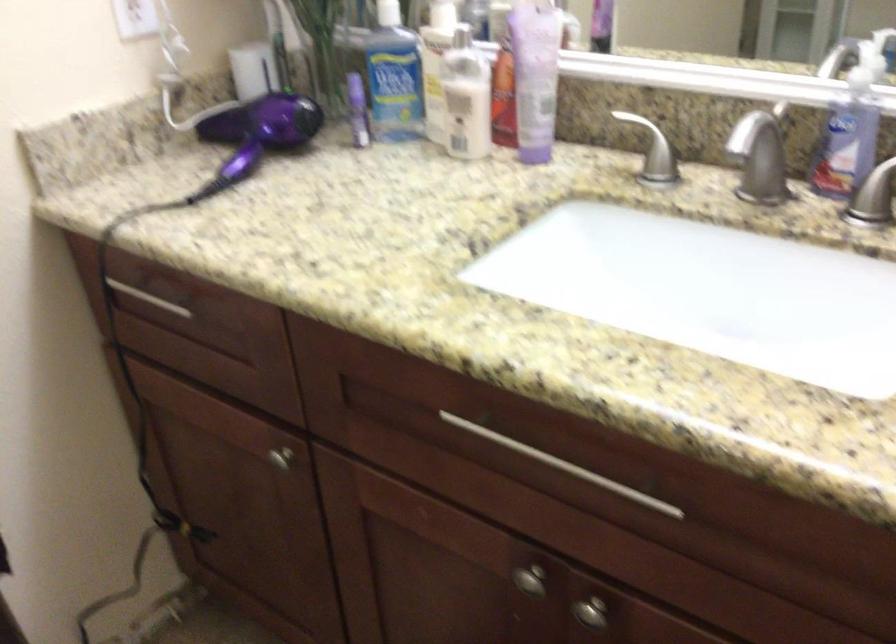
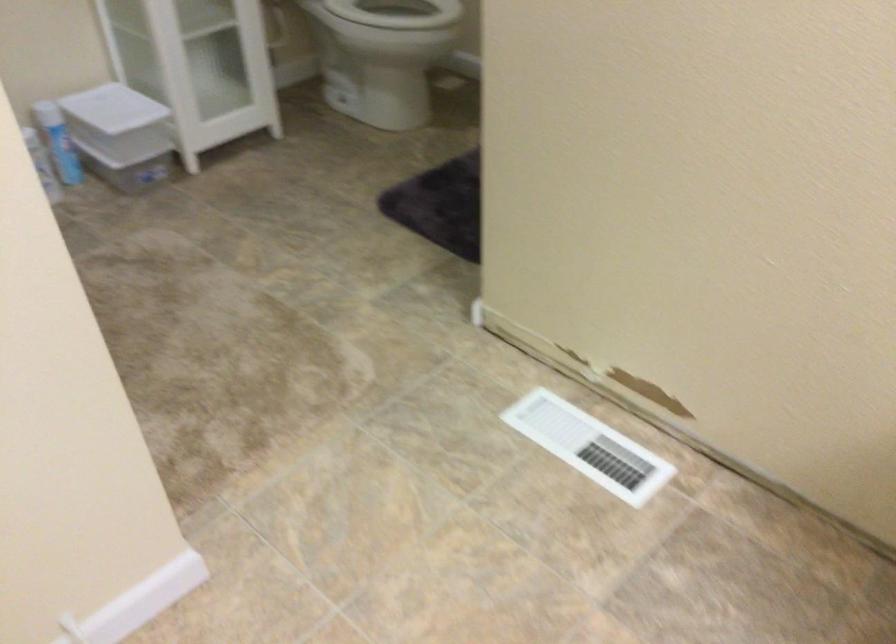
The images are taken continuously from a first-person perspective. In which direction is your viewpoint rotating?

The camera's rotation is toward left-down.